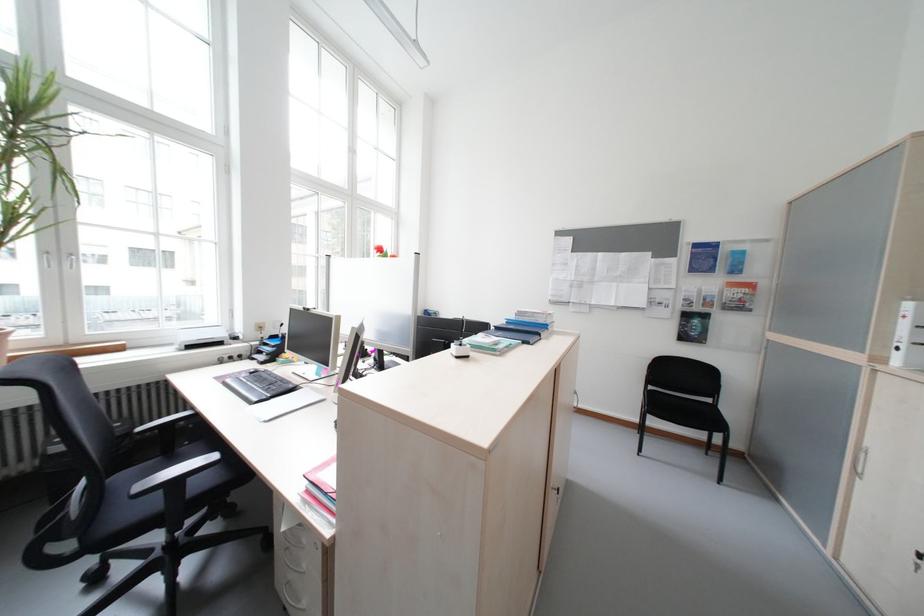
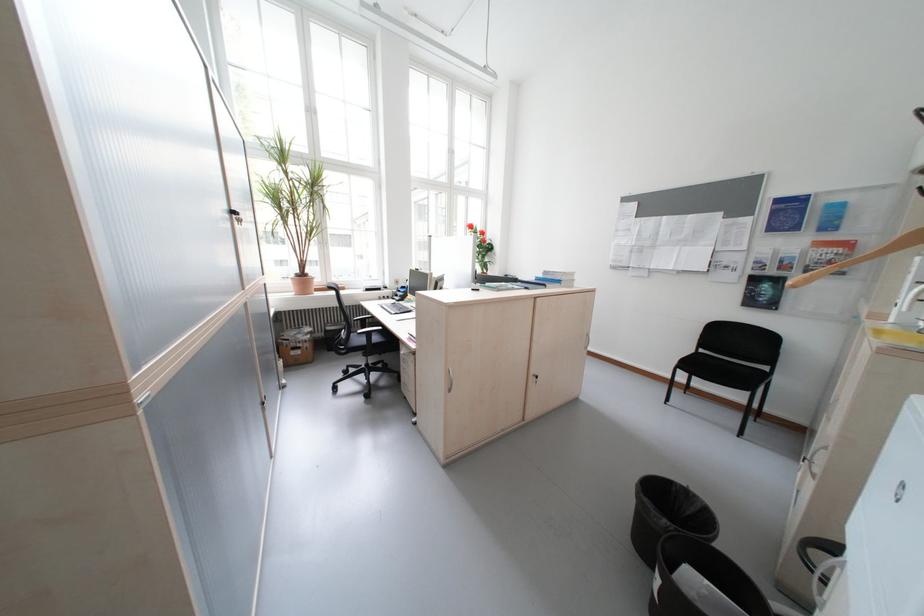
The point at (763, 296) is marked in the first image. Where is the corresponding point in the second image?

(859, 257)